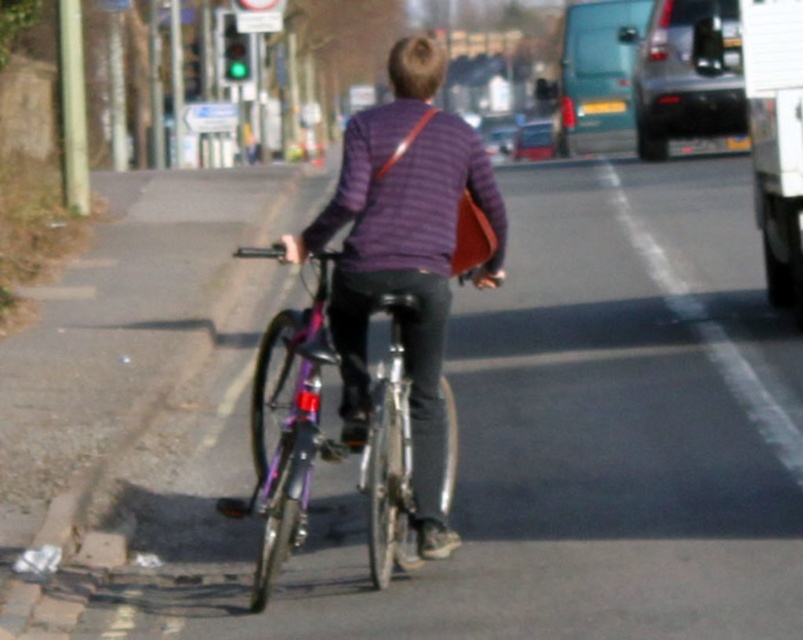
Question: From the image, what is the correct spatial relationship of purple striped sweater at center in relation to shiny purple bicycle at center?

Choices:
 (A) left
 (B) right

Answer: (B)

Question: Among these points, which one is nearest to the camera?

Choices:
 (A) (445, 483)
 (B) (429, 99)

Answer: (B)

Question: Which point appears farthest from the camera in this image?

Choices:
 (A) (414, 141)
 (B) (294, 330)

Answer: (B)

Question: Can you confirm if purple striped sweater at center is bigger than shiny purple bicycle at center?

Choices:
 (A) yes
 (B) no

Answer: (B)

Question: Is purple striped sweater at center smaller than shiny purple bicycle at center?

Choices:
 (A) yes
 (B) no

Answer: (A)